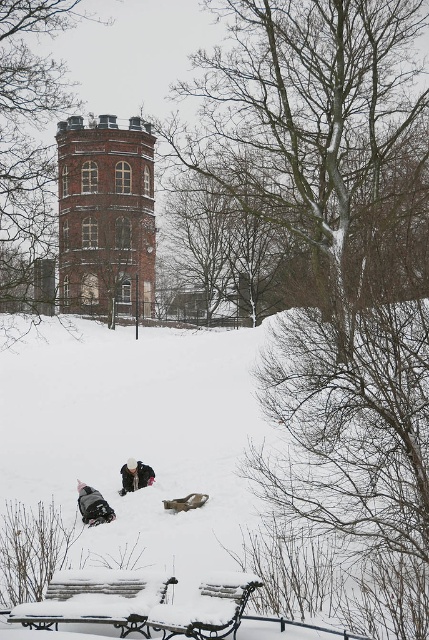
You are standing at the point marked by the coordinate point at [141,433] in the image. What is the terrain like under your feet?

The terrain under your feet at point [141,433] is white fluffy snow at lower center.

You are a photographer planning to take a group photo of the dark gray snowsuit at lower left and the white snowsuit at lower center. Since you want both to be in focus, you need to know which one is closer to the camera. Can you determine which one is closer?

The dark gray snowsuit at lower left is bigger than the white snowsuit at lower center, so the dark gray snowsuit at lower left is closer to the camera because objects that are larger in the image are typically closer to the viewer.